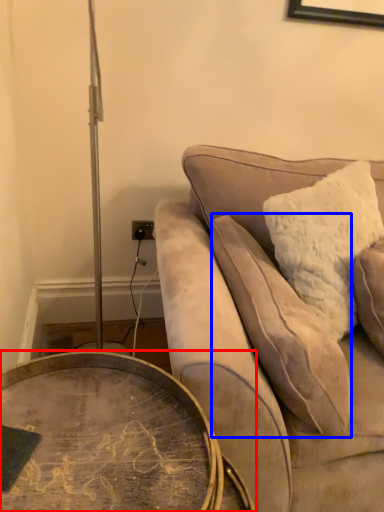
Question: Which object is further to the camera taking this photo, coffee table (highlighted by a red box) or pillow (highlighted by a blue box)?

Choices:
 (A) coffee table
 (B) pillow

Answer: (B)